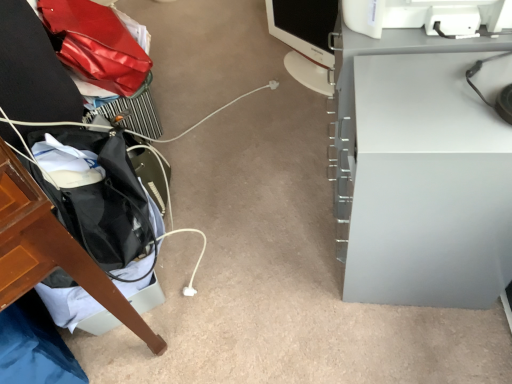
What is the approximate width of white matte computer desk at right?

The width of white matte computer desk at right is 17.93 inches.

The width and height of the screenshot is (512, 384). What do you see at coordinates (420, 172) in the screenshot? I see `white matte computer desk at right` at bounding box center [420, 172].

Locate an element on the screen. white matte computer desk at right is located at coordinates (420, 172).

You are a GUI agent. You are given a task and a screenshot of the screen. Output one action in this format:
    pyautogui.click(x=<x>, y=<y>)
    Task: Click on the matte black monitor at center
    This screenshot has width=512, height=384.
    Given the screenshot: What is the action you would take?
    pyautogui.click(x=305, y=39)

What do you see at coordinates (305, 39) in the screenshot? I see `matte black monitor at center` at bounding box center [305, 39].

Measure the distance between matte black monitor at center and camera.

The distance of matte black monitor at center from camera is 1.63 meters.

This screenshot has height=384, width=512. I want to click on white matte computer desk at right, so pyautogui.click(x=420, y=172).

Considering the relative positions of white matte computer desk at right and matte black monitor at center in the image provided, is white matte computer desk at right to the left or to the right of matte black monitor at center?

white matte computer desk at right is to the right of matte black monitor at center.

Considering their positions, is white matte computer desk at right located in front of or behind matte black monitor at center?

white matte computer desk at right is positioned closer to the viewer than matte black monitor at center.

Between point (368, 267) and point (275, 25), which one is positioned in front?

The point (368, 267) is more forward.

From the image's perspective, is white matte computer desk at right under matte black monitor at center?

Yes, from the image's perspective, white matte computer desk at right is below matte black monitor at center.

From a real-world perspective, is white matte computer desk at right above or below matte black monitor at center?

Clearly, from a real-world perspective, white matte computer desk at right is above matte black monitor at center.

Is white matte computer desk at right thinner than matte black monitor at center?

No.

Is white matte computer desk at right shorter than matte black monitor at center?

In fact, white matte computer desk at right may be taller than matte black monitor at center.

Consider the image. Does white matte computer desk at right have a smaller size compared to matte black monitor at center?

No, white matte computer desk at right is not smaller than matte black monitor at center.

Looking at this image, is white matte computer desk at right located outside matte black monitor at center?

Yes, white matte computer desk at right is outside of matte black monitor at center.

Is white matte computer desk at right in contact with matte black monitor at center?

white matte computer desk at right is not next to matte black monitor at center, and they're not touching.

Is white matte computer desk at right positioned with its back to matte black monitor at center?

No, white matte computer desk at right is not facing the opposite direction of matte black monitor at center.

How many degrees apart are the facing directions of white matte computer desk at right and matte black monitor at center?

The angle between the facing direction of white matte computer desk at right and the facing direction of matte black monitor at center is 49 degrees.

The width and height of the screenshot is (512, 384). Find the location of `computer desk below the matte black monitor at center (from the image's perspective)`. computer desk below the matte black monitor at center (from the image's perspective) is located at coordinates (420, 172).

Is matte black monitor at center to the left of white matte computer desk at right from the viewer's perspective?

Indeed, matte black monitor at center is positioned on the left side of white matte computer desk at right.

Considering the relative positions of matte black monitor at center and white matte computer desk at right in the image provided, is matte black monitor at center in front of white matte computer desk at right?

No.

Does point (312, 36) come behind point (359, 198)?

Yes, it is.

From the image's perspective, is matte black monitor at center above or below white matte computer desk at right?

matte black monitor at center is above white matte computer desk at right.

From a real-world perspective, who is located lower, matte black monitor at center or white matte computer desk at right?

matte black monitor at center, from a real-world perspective.

Can you confirm if matte black monitor at center is wider than white matte computer desk at right?

Incorrect, the width of matte black monitor at center does not surpass that of white matte computer desk at right.

In terms of height, does matte black monitor at center look taller or shorter compared to white matte computer desk at right?

matte black monitor at center is shorter than white matte computer desk at right.

Does matte black monitor at center have a larger size compared to white matte computer desk at right?

Incorrect, matte black monitor at center is not larger than white matte computer desk at right.

Is matte black monitor at center located outside white matte computer desk at right?

matte black monitor at center lies outside white matte computer desk at right's area.

Would you say matte black monitor at center is a long distance from white matte computer desk at right?

They are positioned close to each other.

Is matte black monitor at center oriented away from white matte computer desk at right?

No, white matte computer desk at right is not at the back of matte black monitor at center.

How distant is matte black monitor at center from white matte computer desk at right?

34.20 inches.

Image resolution: width=512 pixels, height=384 pixels. I want to click on computer monitor that appears behind the white matte computer desk at right, so click(305, 39).

You are a GUI agent. You are given a task and a screenshot of the screen. Output one action in this format:
    pyautogui.click(x=<x>, y=<y>)
    Task: Click on the computer monitor behind the white matte computer desk at right
    The height and width of the screenshot is (384, 512).
    Given the screenshot: What is the action you would take?
    pyautogui.click(x=305, y=39)

Locate an element on the screen. computer monitor on the left of white matte computer desk at right is located at coordinates (305, 39).